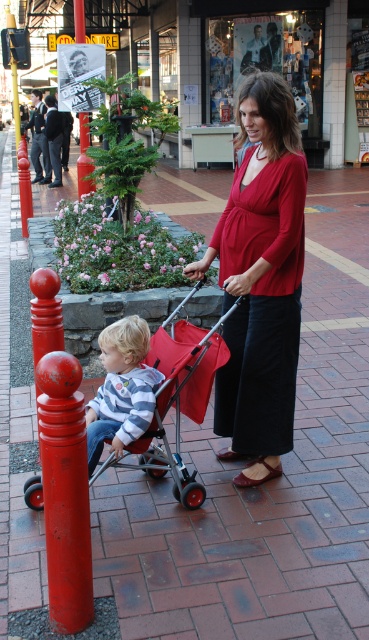
You are standing on the paved urban street and want to walk from point (242, 477) to point (160, 436). Which direction should you move relative to your current position?

You should move backward because point (242, 477) is closer to you than point (160, 436), so moving backward will take you towards the latter point.

You are standing on the paved urban street and want to walk from point (x=149, y=384) to point (x=87, y=179). Which direction should you move in to get closer to the destination?

You should move away from the viewer since point (x=87, y=179) is further away from the viewer compared to point (x=149, y=384).

You are standing on the paved urban street and want to find the exact location of the matte red stroller at center. According to the coordinates given, where would you look?

The matte red stroller at center is located at the coordinates point (181, 396).